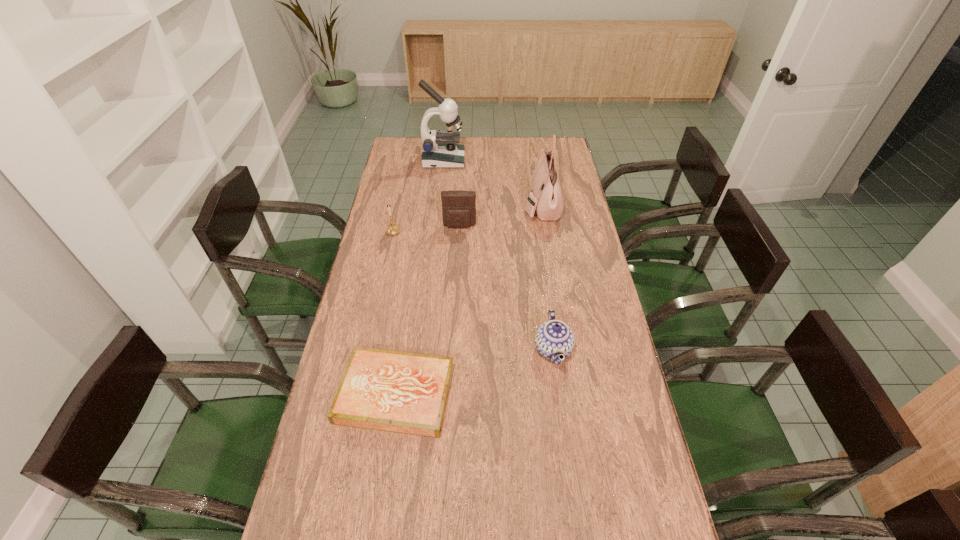
This screenshot has height=540, width=960. What are the coordinates of `vacant area located 0.330m on the side of the handbag with the attached pouch` in the screenshot? It's located at (445, 204).

Locate an element on the screen. This screenshot has height=540, width=960. vacant space located 0.090m with an open flap on the pouch is located at coordinates (459, 246).

Image resolution: width=960 pixels, height=540 pixels. What are the coordinates of `vacant space positioned 0.400m on the handle side of the candle holder` in the screenshot? It's located at (406, 170).

In order to click on free point located 0.130m on the handle side of the candle holder in this screenshot , I will do `click(399, 205)`.

Where is `free space located on the handle side of the candle holder`? This screenshot has width=960, height=540. free space located on the handle side of the candle holder is located at coordinates (402, 190).

Identify the location of vacant space located 0.130m at the spout of the chinaware. The height and width of the screenshot is (540, 960). (492, 349).

The image size is (960, 540). Identify the location of free location located at the spout of the chinaware. (420, 349).

This screenshot has height=540, width=960. In order to click on vacant space located at the spout of the chinaware in this screenshot , I will do `click(432, 349)`.

I want to click on blank space located on the back of the hardback book, so click(415, 267).

The height and width of the screenshot is (540, 960). Find the location of `object at the far edge`. object at the far edge is located at coordinates (440, 150).